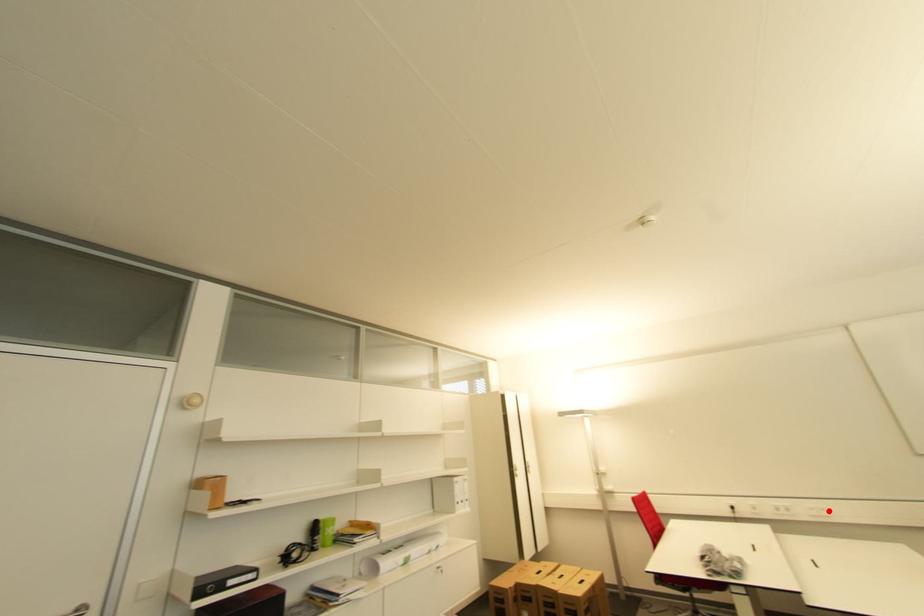
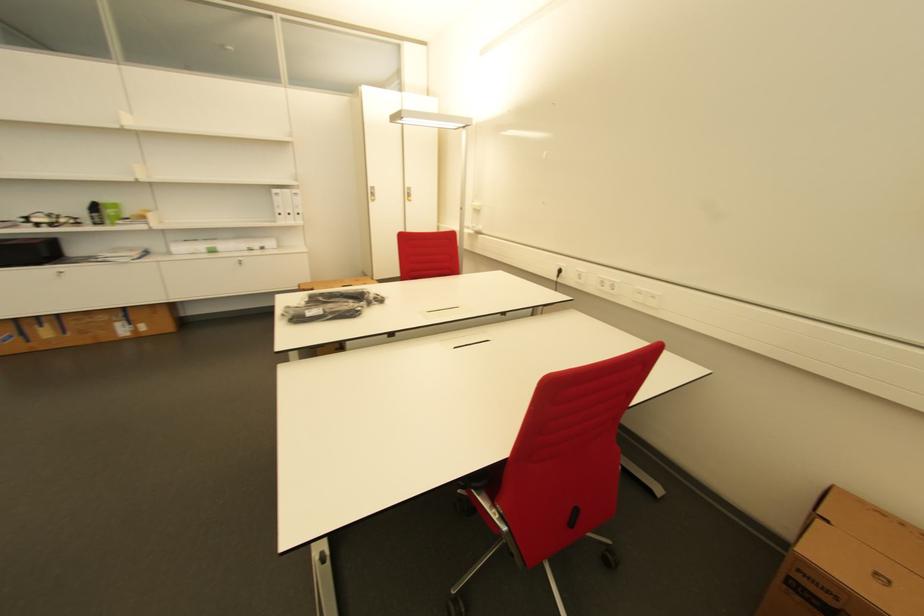
Locate, in the second image, the point that corresponds to the highlighted location in the first image.

(659, 299)